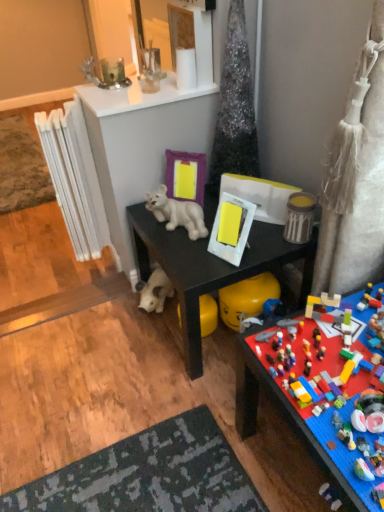
What do you see at coordinates (210, 267) in the screenshot? The width and height of the screenshot is (384, 512). I see `black matte desk at center` at bounding box center [210, 267].

Identify the location of white glossy mirror at upper center. The image size is (384, 512). (179, 34).

Locate an element on the screen. white glossy plastic lion at center, which is counted as the 4th toy, starting from the bottom is located at coordinates tap(177, 213).

Locate an element on the screen. white plush toy at lower center, which is the 2th toy from bottom to top is located at coordinates (154, 291).

In order to face white glossy picture frame at center, the 1th picture frame positioned from the right, should I rotate leftwards or rightwards?

It's best to rotate right around 5.535 degrees.

How much space does clear glass container at upper center, arranged as the 5th toy when ordered from the bottom, occupy horizontally?

3.81 inches.

Identify the location of black matte desk at center. This screenshot has width=384, height=512. (210, 267).

Consider the image. Is there a large distance between purple matte picture frame at center, the 1th picture frame viewed from the left, and clear glass container at upper center, which is the 2th toy from top to bottom?

purple matte picture frame at center, the 1th picture frame viewed from the left, is positioned a significant distance from clear glass container at upper center, which is the 2th toy from top to bottom.

Between purple matte picture frame at center, the second picture frame when ordered from bottom to top, and clear glass container at upper center, which is the 2th toy from top to bottom, which one has less height?

clear glass container at upper center, which is the 2th toy from top to bottom.

Considering the sizes of objects purple matte picture frame at center, which is the 1th picture frame in top-to-bottom order, and clear glass container at upper center, which is the 2th toy from top to bottom, in the image provided, who is wider, purple matte picture frame at center, which is the 1th picture frame in top-to-bottom order, or clear glass container at upper center, which is the 2th toy from top to bottom,?

With larger width is clear glass container at upper center, which is the 2th toy from top to bottom.

Is purple matte picture frame at center, placed as the second picture frame when sorted from front to back, oriented away from clear glass container at upper center, arranged as the 5th toy when ordered from the bottom?

purple matte picture frame at center, placed as the second picture frame when sorted from front to back, does not have its back to clear glass container at upper center, arranged as the 5th toy when ordered from the bottom.

In the scene shown: Which object is positioned more to the left, black matte desk at center or purple matte picture frame at center, the 1th picture frame viewed from the left?

purple matte picture frame at center, the 1th picture frame viewed from the left, is more to the left.

How many degrees apart are the facing directions of black matte desk at center and purple matte picture frame at center, the first picture frame in the back-to-front sequence?

49.1 degrees.

Is black matte desk at center positioned before purple matte picture frame at center, the first picture frame in the back-to-front sequence?

Yes, black matte desk at center is closer to the camera.

Is there a large distance between black matte desk at center and purple matte picture frame at center, which is the 1th picture frame in top-to-bottom order?

Actually, black matte desk at center and purple matte picture frame at center, which is the 1th picture frame in top-to-bottom order, are a little close together.

Does point (332, 426) appear closer or farther from the camera than point (139, 305)?

Clearly, point (332, 426) is closer to the camera than point (139, 305).

Between multicolored plastic lego set at lower right, which is counted as the first toy, starting from the bottom, and white plush toy at lower center, acting as the fifth toy starting from the top, which one has smaller width?

With smaller width is white plush toy at lower center, acting as the fifth toy starting from the top.

Where is `toy that is the 1st one above the white plush toy at lower center, acting as the fifth toy starting from the top (from a real-world perspective)`? Image resolution: width=384 pixels, height=512 pixels. toy that is the 1st one above the white plush toy at lower center, acting as the fifth toy starting from the top (from a real-world perspective) is located at coordinates (297, 419).

Where is `radiator on the left of white glossy mirror at upper center`? radiator on the left of white glossy mirror at upper center is located at coordinates (75, 179).

Is white plastic radiator at left oriented away from white glossy mirror at upper center?

Absolutely, white plastic radiator at left is directed away from white glossy mirror at upper center.

Consider the image. Is white plastic radiator at left at the left side of white glossy mirror at upper center?

Correct, you'll find white plastic radiator at left to the left of white glossy mirror at upper center.

From the image's perspective, is white plastic radiator at left below white glossy mirror at upper center?

Yes, from the image's perspective, white plastic radiator at left is below white glossy mirror at upper center.

Is white glossy plastic lion at center, which is counted as the 4th toy, starting from the bottom, far from black matte desk at center?

No, there isn't a large distance between white glossy plastic lion at center, which is counted as the 4th toy, starting from the bottom, and black matte desk at center.

From the image's perspective, is white glossy plastic lion at center, which is counted as the third toy, starting from the top, beneath black matte desk at center?

No, from the image's perspective, white glossy plastic lion at center, which is counted as the third toy, starting from the top, is not below black matte desk at center.

Considering the relative sizes of white glossy plastic lion at center, which is counted as the third toy, starting from the top, and black matte desk at center in the image provided, is white glossy plastic lion at center, which is counted as the third toy, starting from the top, shorter than black matte desk at center?

Correct, white glossy plastic lion at center, which is counted as the third toy, starting from the top, is not as tall as black matte desk at center.

Is point (299, 359) more distant than point (193, 203)?

No, it is not.

Does multicolored plastic lego set at lower right, the 6th toy from the top, have a lesser height compared to white glossy plastic lion at center, which is counted as the third toy, starting from the top?

No, multicolored plastic lego set at lower right, the 6th toy from the top, is not shorter than white glossy plastic lion at center, which is counted as the third toy, starting from the top.

From a real-world perspective, between multicolored plastic lego set at lower right, the 6th toy from the top, and white glossy plastic lion at center, which is counted as the third toy, starting from the top, who is vertically higher?

From a 3D spatial view, white glossy plastic lion at center, which is counted as the third toy, starting from the top, is above.

Which of these two, multicolored plastic lego set at lower right, the 6th toy from the top, or white glossy plastic lion at center, which is counted as the third toy, starting from the top, is wider?

multicolored plastic lego set at lower right, the 6th toy from the top, is wider.

Is white glossy mirror at upper center far from green glass candle at upper center, which ranks as the 6th toy in bottom-to-top order?

No, white glossy mirror at upper center is in close proximity to green glass candle at upper center, which ranks as the 6th toy in bottom-to-top order.

Measure the distance from white glossy mirror at upper center to green glass candle at upper center, the 1th toy viewed from the top.

white glossy mirror at upper center and green glass candle at upper center, the 1th toy viewed from the top, are 32.18 inches apart.

Which object is thinner, white glossy mirror at upper center or green glass candle at upper center, which ranks as the 6th toy in bottom-to-top order?

Thinner between the two is white glossy mirror at upper center.

From the image's perspective, is white glossy mirror at upper center located above green glass candle at upper center, the 1th toy viewed from the top?

Yes, from the image's perspective, white glossy mirror at upper center is over green glass candle at upper center, the 1th toy viewed from the top.

Starting from the purple matte picture frame at center, placed as the second picture frame when sorted from front to back, which toy is the 1st one in front? Please provide its 2D coordinates.

[(150, 69)]

You are a GUI agent. You are given a task and a screenshot of the screen. Output one action in this format:
    pyautogui.click(x=<x>, y=<y>)
    Task: Click on the 2nd picture frame positioned above the black matte desk at center (from the image's perspective)
    
    Given the screenshot: What is the action you would take?
    pos(185,176)

Considering their positions, is white glossy mirror at upper center positioned further to white plastic radiator at left than sparkly silver christmas tree at upper center?

white glossy mirror at upper center is positioned further to the anchor white plastic radiator at left.

Considering their positions, is white glossy picture frame at center, which is the 1th picture frame in front-to-back order, positioned further to purple matte picture frame at center, placed as the second picture frame when sorted from right to left, than clear glass container at upper center, which is the 2th toy from top to bottom?

clear glass container at upper center, which is the 2th toy from top to bottom, is further to purple matte picture frame at center, placed as the second picture frame when sorted from right to left.

Considering their positions, is metallic silver canister at upper right, positioned as the 4th toy in top-to-bottom order, positioned closer to white glossy picture frame at center, marked as the 2th picture frame in a back-to-front arrangement, than white glossy plastic lion at center, which is counted as the third toy, starting from the top?

white glossy plastic lion at center, which is counted as the third toy, starting from the top, lies closer to white glossy picture frame at center, marked as the 2th picture frame in a back-to-front arrangement, than the other object.

Estimate the real-world distances between objects in this image. Which object is further from white glossy picture frame at center, positioned as the 2th picture frame in top-to-bottom order, white glossy plastic lion at center, which is counted as the third toy, starting from the top, or metallic silver canister at upper right, acting as the 3th toy starting from the bottom?

metallic silver canister at upper right, acting as the 3th toy starting from the bottom, is further to white glossy picture frame at center, positioned as the 2th picture frame in top-to-bottom order.

Which object lies nearer to the anchor point white glossy picture frame at center, marked as the 1th picture frame in a bottom-to-top arrangement, metallic silver canister at upper right, acting as the 3th toy starting from the bottom, or white glossy mirror at upper center?

metallic silver canister at upper right, acting as the 3th toy starting from the bottom, is closer to white glossy picture frame at center, marked as the 1th picture frame in a bottom-to-top arrangement.

When comparing their distances from metallic silver canister at upper right, acting as the 3th toy starting from the bottom, does multicolored plastic lego set at lower right, the 6th toy from the top, or black matte desk at center seem further?

multicolored plastic lego set at lower right, the 6th toy from the top, lies further to metallic silver canister at upper right, acting as the 3th toy starting from the bottom, than the other object.

Estimate the real-world distances between objects in this image. Which object is further from metallic silver canister at upper right, positioned as the 4th toy in top-to-bottom order, clear glass container at upper center, which is the 2th toy from top to bottom, or white glossy mirror at upper center?

clear glass container at upper center, which is the 2th toy from top to bottom.

Based on their spatial positions, is sparkly silver christmas tree at upper center or black matte desk at center closer to purple matte picture frame at center, the first picture frame in the back-to-front sequence?

sparkly silver christmas tree at upper center.

At what (x,y) coordinates should I click in order to perform the action: click on desk between multicolored plastic lego set at lower right, the 6th toy from the top, and white plush toy at lower center, which is the 2th toy from bottom to top, in the front-back direction. Please return your answer as a coordinate pair (x, y). The width and height of the screenshot is (384, 512). Looking at the image, I should click on (210, 267).

You are a GUI agent. You are given a task and a screenshot of the screen. Output one action in this format:
    pyautogui.click(x=<x>, y=<y>)
    Task: Click on the desk positioned between multicolored plastic lego set at lower right, the 6th toy from the top, and metallic silver canister at upper right, acting as the 3th toy starting from the bottom, from near to far
    The width and height of the screenshot is (384, 512).
    Given the screenshot: What is the action you would take?
    pyautogui.click(x=210, y=267)

At what (x,y) coordinates should I click in order to perform the action: click on picture frame between sparkly silver christmas tree at upper center and white glossy picture frame at center, marked as the 1th picture frame in a bottom-to-top arrangement, from top to bottom. Please return your answer as a coordinate pair (x, y). Looking at the image, I should click on 185,176.

Where is `picture frame between purple matte picture frame at center, placed as the second picture frame when sorted from right to left, and multicolored plastic lego set at lower right, which is counted as the first toy, starting from the bottom, from top to bottom`? picture frame between purple matte picture frame at center, placed as the second picture frame when sorted from right to left, and multicolored plastic lego set at lower right, which is counted as the first toy, starting from the bottom, from top to bottom is located at coordinates 231,228.